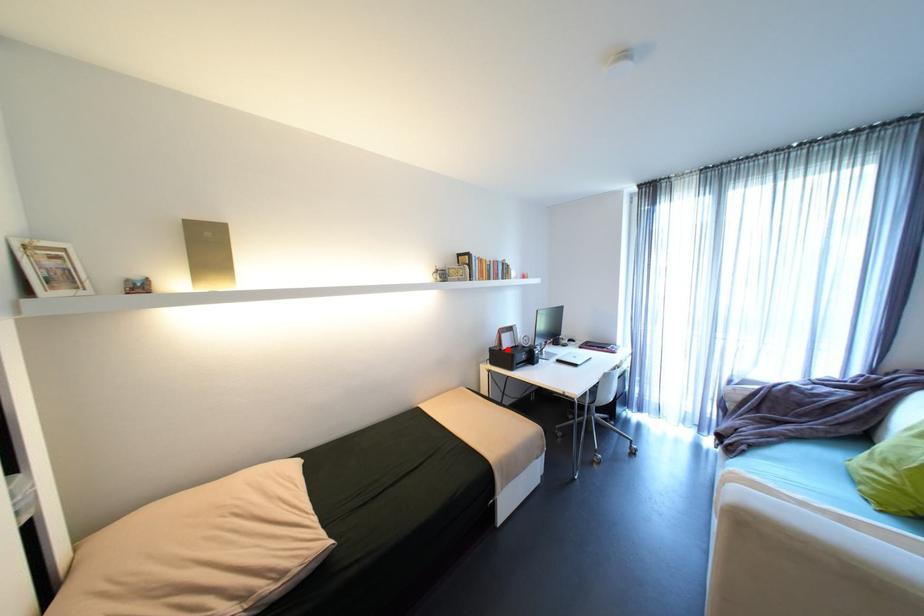
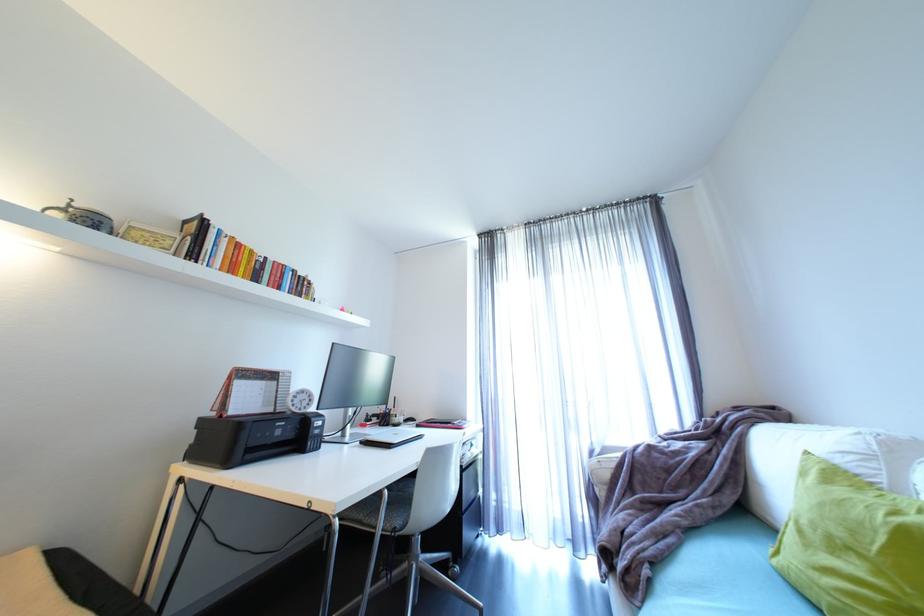
The point at the highlighted location is marked in the first image. Where is the corresponding point in the second image?

(228, 416)